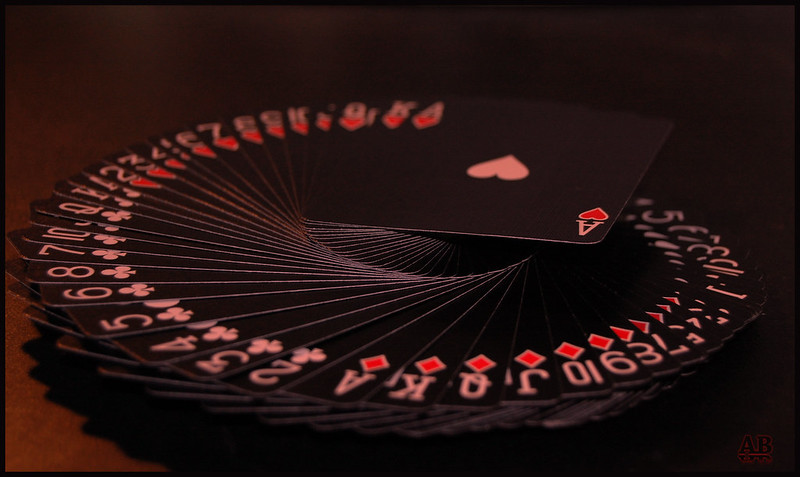
This screenshot has width=800, height=477. In order to click on table in this screenshot , I will do `click(246, 49)`.